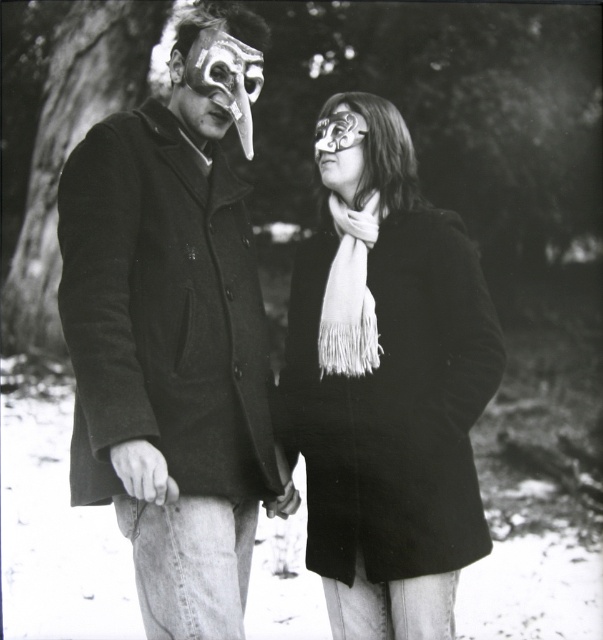
Question: Does white fringed scarf at center have a lesser width compared to matte black mask at upper left?

Choices:
 (A) yes
 (B) no

Answer: (A)

Question: Observing the image, what is the correct spatial positioning of white fringed scarf at center in reference to matte black mask at center?

Choices:
 (A) left
 (B) right

Answer: (B)

Question: Which object is the closest to the white fringed scarf at center?

Choices:
 (A) matte black mask at upper left
 (B) matte black coat at left

Answer: (B)

Question: Which of the following is the farthest from the observer?

Choices:
 (A) white fringed scarf at center
 (B) matte black mask at center
 (C) matte black coat at left
 (D) matte black coat at center

Answer: (B)

Question: Which point is closer to the camera?

Choices:
 (A) (341, 124)
 (B) (253, 276)
 (C) (355, 326)
 (D) (204, 61)

Answer: (D)

Question: Is matte black coat at left closer to camera compared to matte black mask at upper left?

Choices:
 (A) no
 (B) yes

Answer: (B)